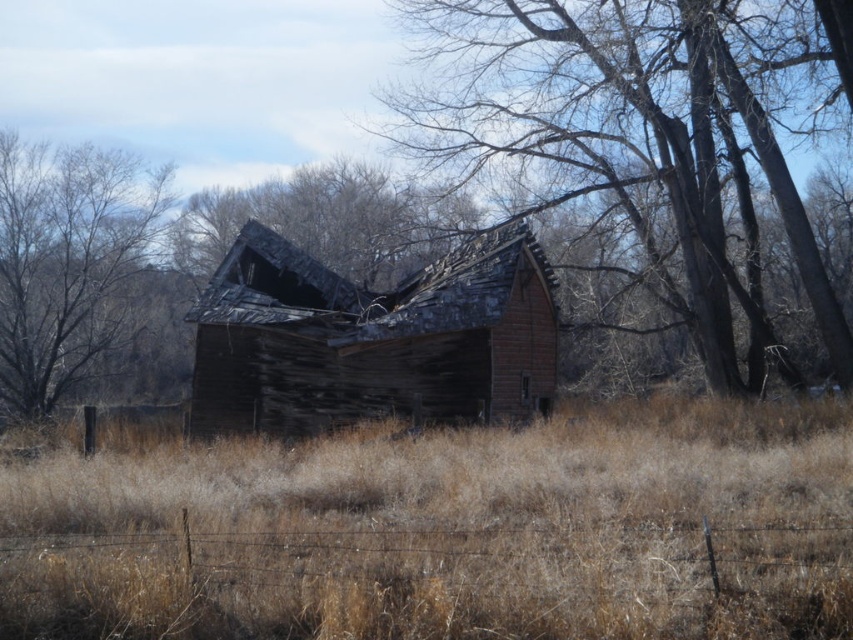
You are standing in front of the abandoned barn and notice a smooth bark tree at center and a weathered wood roof at center. Which object is closer to you?

The smooth bark tree at center is closer to you because it is in front of the weathered wood roof at center.

You are a bird looking for a nesting spot. You see the smooth bark tree at center and the weathered wood roof at center. Which location would provide a higher nesting spot?

The smooth bark tree at center is much taller than the weathered wood roof at center, so the smooth bark tree at center would provide a higher nesting spot.

You are standing in the field of dry grass and want to walk to the weathered wood barn at center. Which direction should you head relative to the brown rough bark tree at upper left?

You should head to the right of the brown rough bark tree at upper left because the weathered wood barn at center is located to the right of it.